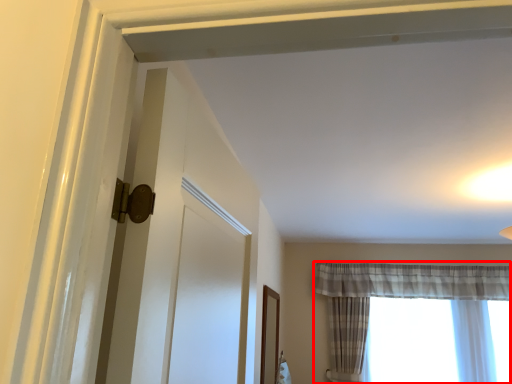
Question: From the image's perspective, what is the correct spatial positioning of curtain (annotated by the red box) in reference to window?

Choices:
 (A) above
 (B) below

Answer: (A)